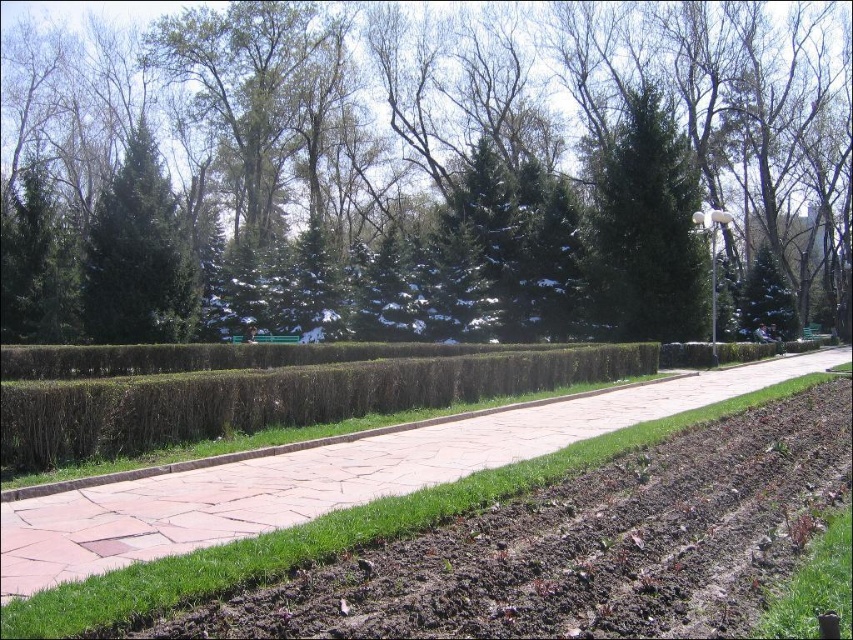
Does brown soil at center appear under green textured evergreen tree at upper left?

Correct, brown soil at center is located below green textured evergreen tree at upper left.

Looking at this image, who is lower down, brown soil at center or green textured evergreen tree at upper left?

Positioned lower is brown soil at center.

You are a GUI agent. You are given a task and a screenshot of the screen. Output one action in this format:
    pyautogui.click(x=<x>, y=<y>)
    Task: Click on the brown soil at center
    The height and width of the screenshot is (640, 853).
    Given the screenshot: What is the action you would take?
    pyautogui.click(x=328, y=532)

Does brown textured hedge at center have a smaller size compared to brown soil at center?

Incorrect, brown textured hedge at center is not smaller in size than brown soil at center.

Can you confirm if brown textured hedge at center is shorter than brown soil at center?

No, brown textured hedge at center is not shorter than brown soil at center.

Is point (158, 406) closer to viewer compared to point (282, 532)?

No, (158, 406) is further to viewer.

The width and height of the screenshot is (853, 640). In order to click on brown textured hedge at center in this screenshot , I will do `click(276, 397)`.

Is brown soil at center to the left of green needle-like at center from the viewer's perspective?

Indeed, brown soil at center is positioned on the left side of green needle-like at center.

Which of these two, brown soil at center or green needle-like at center, stands taller?

With more height is green needle-like at center.

Where is `brown soil at center`? This screenshot has width=853, height=640. brown soil at center is located at coordinates (328, 532).